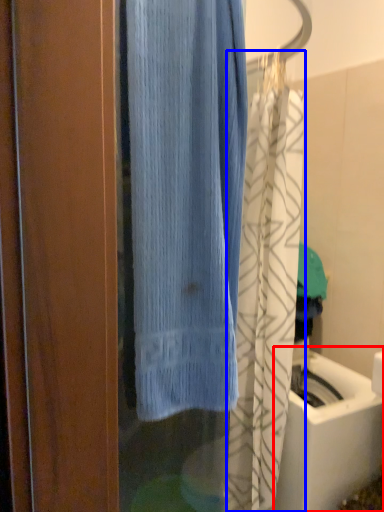
Question: Which of the following is the farthest to the observer, sink (highlighted by a red box) or shower curtain (highlighted by a blue box)?

Choices:
 (A) sink
 (B) shower curtain

Answer: (A)